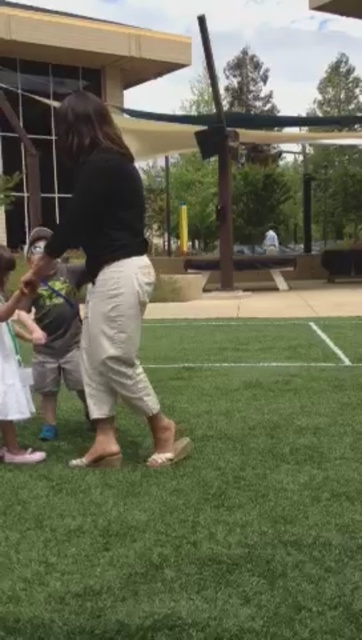
You are standing at the point with coordinates point (73,352) and want to walk to the point with coordinates point (203,605). Which direction should you move relative to your current position?

You should move forward because point (203,605) is in front of point (73,352).

You are a delivery person trying to place a package that is 16 inches long on the ground between the matte black shirt at center and the white fabric bag at lower left. Can the package fit in the space between them?

The distance between the matte black shirt at center and the white fabric bag at lower left is 15.53 inches. Since the package is 16 inches long, it cannot fit in the space between them as the available space is slightly shorter than the package length.

You are a photographer positioned at the origin point of the image coordinate system. You want to capture a photo of the matte black shirt at center. What are the coordinates where you should aim your camera?

The coordinates to aim your camera are at point (107, 276) as the matte black shirt at center is located there.